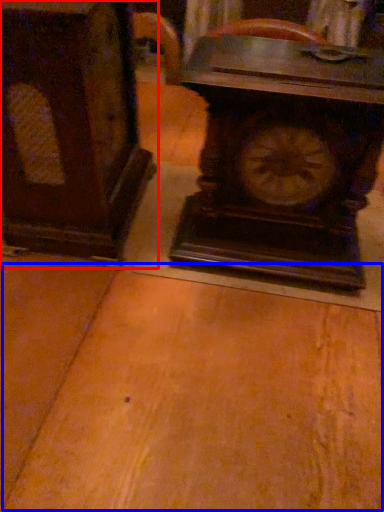
Question: Which point is further to the camera, furniture (highlighted by a red box) or table (highlighted by a blue box)?

Choices:
 (A) furniture
 (B) table

Answer: (A)